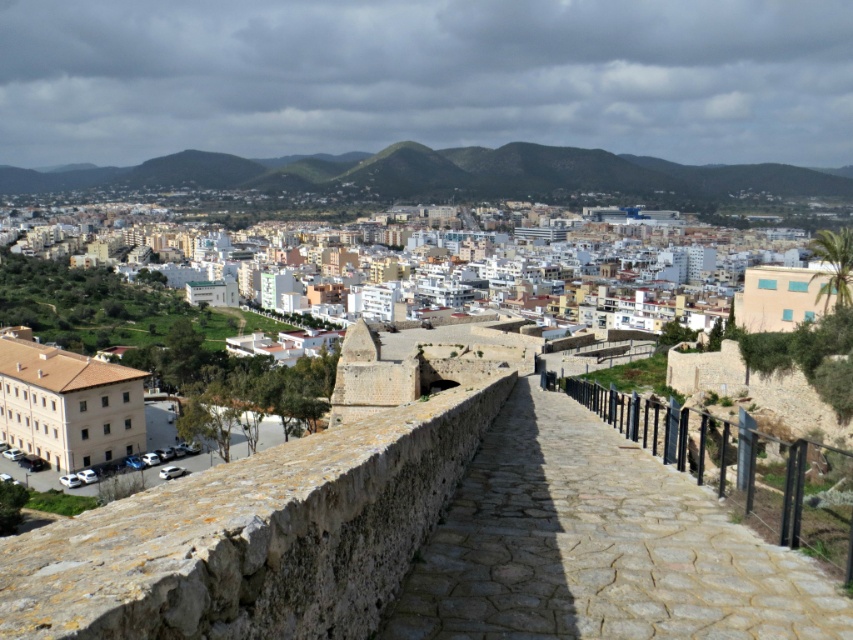
Consider the image. How far apart are green grassy hill at upper center and stone wall at center?

A distance of 1738.56 feet exists between green grassy hill at upper center and stone wall at center.

Is green grassy hill at upper center bigger than stone wall at center?

Yes, green grassy hill at upper center is bigger than stone wall at center.

Identify the location of green grassy hill at upper center. This screenshot has width=853, height=640. (448, 173).

I want to click on stone paved pathway at center, so click(x=598, y=547).

Is point (543, 438) in front of point (76, 444)?

That is True.

Image resolution: width=853 pixels, height=640 pixels. I want to click on stone paved pathway at center, so click(598, 547).

Does point (444, 616) come farther from viewer compared to point (405, 172)?

No, (444, 616) is closer to viewer.

Looking at this image, does stone paved pathway at center appear on the left side of green grassy hill at upper center?

No, stone paved pathway at center is not to the left of green grassy hill at upper center.

Is point (433, 627) behind point (599, 148)?

No, (433, 627) is in front of (599, 148).

In order to click on stone paved pathway at center in this screenshot , I will do `click(598, 547)`.